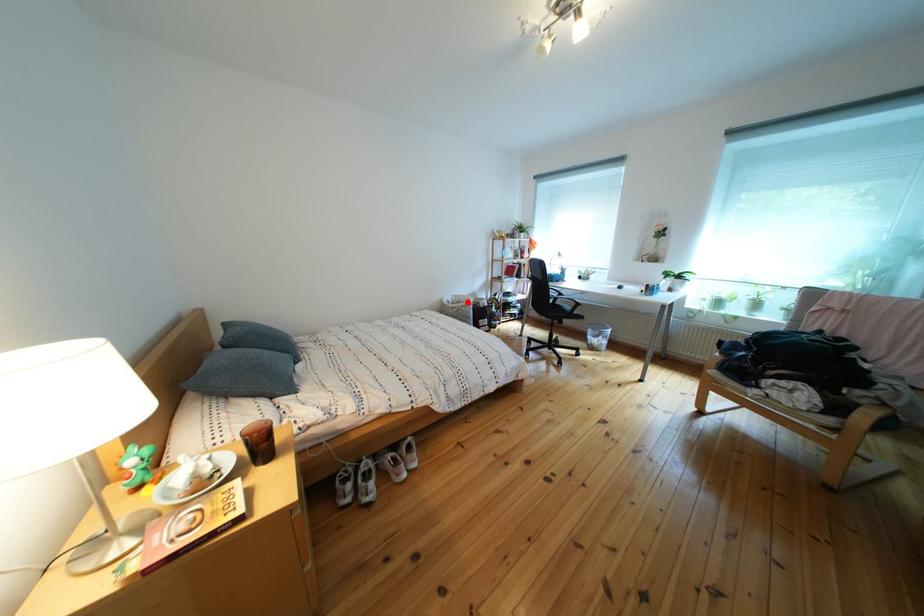
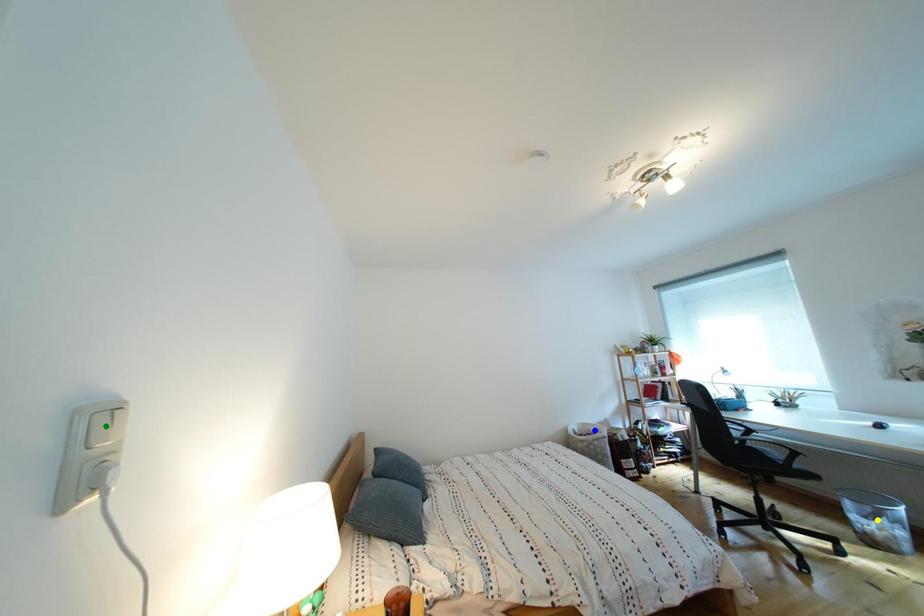
Question: I am providing you with two images of the same scene from different viewpoints. A red point is marked on the first image. You are given multiple points on the second image. In image 2, which mark is for the same physical point as the one in image 1?

Choices:
 (A) green point
 (B) yellow point
 (C) blue point

Answer: (C)